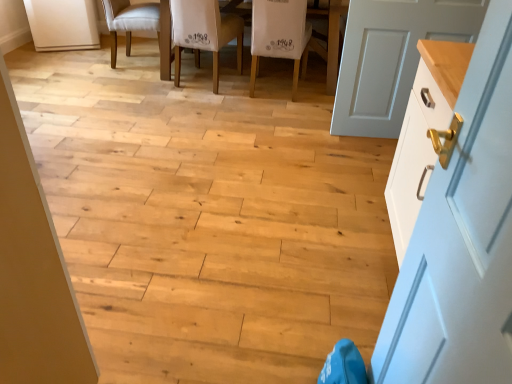
Describe the element at coordinates (130, 21) in the screenshot. The width and height of the screenshot is (512, 384). I see `white fabric chair at upper center, which appears as the third chair when viewed from the right` at that location.

The width and height of the screenshot is (512, 384). I want to click on white fabric chair at upper center, which appears as the first chair when viewed from the left, so click(130, 21).

Describe the element at coordinates (331, 35) in the screenshot. The image size is (512, 384). I see `wooden table at center` at that location.

Find the location of `white fabric chair at center, the third chair viewed from the left`. white fabric chair at center, the third chair viewed from the left is located at coordinates (280, 35).

Describe the element at coordinates (391, 58) in the screenshot. I see `white painted wood door at right, positioned as the 1th door in right-to-left order` at that location.

Identify the location of white fabric chair at upper center, which appears as the third chair when viewed from the right. The width and height of the screenshot is (512, 384). (130, 21).

From the image's perspective, would you say white painted wood door at right, positioned as the 1th door in right-to-left order, is positioned over wooden table at center?

Actually, white painted wood door at right, positioned as the 1th door in right-to-left order, appears below wooden table at center in the image.

How distant is white painted wood door at right, positioned as the 1th door in right-to-left order, from wooden table at center?

25.01 inches.

Is white painted wood door at right, the 1th door positioned from the back, facing towards wooden table at center?

No, white painted wood door at right, the 1th door positioned from the back, is not facing towards wooden table at center.

Considering the positions of objects white painted wood door at right, the second door when ordered from left to right, and wooden table at center in the image provided, who is more to the right, white painted wood door at right, the second door when ordered from left to right, or wooden table at center?

white painted wood door at right, the second door when ordered from left to right, is more to the right.

From the picture: Who is shorter, white painted wood door at right, which appears as the second door when viewed from the front, or wooden floor at center?

With less height is wooden floor at center.

Which point is more forward, (348, 134) or (318, 60)?

Positioned in front is point (348, 134).

From the image's perspective, does wooden floor at center appear lower than white glossy door at right, which appears as the 2th door when viewed from the right?

No, from the image's perspective, wooden floor at center is not below white glossy door at right, which appears as the 2th door when viewed from the right.

Is wooden floor at center shorter than white glossy door at right, which appears as the 2th door when viewed from the right?

Indeed, wooden floor at center has a lesser height compared to white glossy door at right, which appears as the 2th door when viewed from the right.

From the picture: Which point is more distant from viewer, (61, 119) or (500, 123)?

The point (61, 119) is behind.

Based on the photo, is wooden floor at center looking in the opposite direction of white glossy door at right, the 2th door positioned from the back?

No, wooden floor at center is not facing the opposite direction of white glossy door at right, the 2th door positioned from the back.

Between white fabric chair at center, the 2th chair when ordered from left to right, and white fabric chair at upper center, which appears as the third chair when viewed from the right, which one appears on the right side from the viewer's perspective?

white fabric chair at center, the 2th chair when ordered from left to right.

Can white fabric chair at upper center, which appears as the first chair when viewed from the left, be found inside white fabric chair at center, the 2th chair when ordered from left to right?

Actually, white fabric chair at upper center, which appears as the first chair when viewed from the left, is outside white fabric chair at center, the 2th chair when ordered from left to right.

At what (x,y) coordinates should I click in order to perform the action: click on chair that appears on the left of white fabric chair at center, the 2th chair when ordered from left to right. Please return your answer as a coordinate pair (x, y). Looking at the image, I should click on (130, 21).

Which is farther, (191,24) or (129,18)?

The point (129,18) is farther from the camera.

Is wooden table at center taller than white fabric chair at center, which is the 2th chair from right to left?

Yes, wooden table at center is taller than white fabric chair at center, which is the 2th chair from right to left.

From the image's perspective, is wooden table at center under white fabric chair at center, which is the 2th chair from right to left?

Incorrect, from the image's perspective, wooden table at center is higher than white fabric chair at center, which is the 2th chair from right to left.

Considering the sizes of objects wooden table at center and white fabric chair at center, which is the 2th chair from right to left, in the image provided, who is wider, wooden table at center or white fabric chair at center, which is the 2th chair from right to left,?

wooden table at center is wider.

Is white fabric chair at center, marked as the first chair in a right-to-left arrangement, smaller than white glossy door at right, placed as the 1th door when sorted from left to right?

Incorrect, white fabric chair at center, marked as the first chair in a right-to-left arrangement, is not smaller in size than white glossy door at right, placed as the 1th door when sorted from left to right.

Looking at this image, from the image's perspective, which object appears higher, white fabric chair at center, the third chair viewed from the left, or white glossy door at right, the second door positioned from the top?

white fabric chair at center, the third chair viewed from the left.

Is white fabric chair at center, the third chair viewed from the left, facing away from white glossy door at right, positioned as the first door in bottom-to-top order?

That's right, white fabric chair at center, the third chair viewed from the left, is facing away from white glossy door at right, positioned as the first door in bottom-to-top order.

Is white fabric chair at center, the third chair viewed from the left, inside the boundaries of white glossy door at right, the 2th door positioned from the back, or outside?

white fabric chair at center, the third chair viewed from the left, is located beyond the bounds of white glossy door at right, the 2th door positioned from the back.

Which object is more forward, white fabric chair at center, the third chair viewed from the left, or white fabric chair at upper center, which appears as the first chair when viewed from the left?

Positioned in front is white fabric chair at center, the third chair viewed from the left.

Is white fabric chair at center, marked as the first chair in a right-to-left arrangement, inside or outside of white fabric chair at upper center, which appears as the first chair when viewed from the left?

white fabric chair at center, marked as the first chair in a right-to-left arrangement, lies outside white fabric chair at upper center, which appears as the first chair when viewed from the left.

From a real-world perspective, is white fabric chair at center, marked as the first chair in a right-to-left arrangement, below white fabric chair at upper center, which appears as the first chair when viewed from the left?

No, from a real-world perspective, white fabric chair at center, marked as the first chair in a right-to-left arrangement, is not beneath white fabric chair at upper center, which appears as the first chair when viewed from the left.

Between white fabric chair at center, the third chair viewed from the left, and white fabric chair at upper center, which appears as the first chair when viewed from the left, which one has more height?

With more height is white fabric chair at center, the third chair viewed from the left.

You are a GUI agent. You are given a task and a screenshot of the screen. Output one action in this format:
    pyautogui.click(x=<x>, y=<y>)
    Task: Click on the table directly beneath the white painted wood door at right, which is counted as the 1th door, starting from the top (from a real-world perspective)
    Image resolution: width=512 pixels, height=384 pixels.
    Given the screenshot: What is the action you would take?
    pyautogui.click(x=331, y=35)

This screenshot has height=384, width=512. Identify the location of door lying above the wooden floor at center (from the image's perspective). (391, 58).

When comparing their distances from white painted wood door at right, which appears as the second door when viewed from the front, does white fabric chair at upper center, which appears as the third chair when viewed from the right, or wooden floor at center seem closer?

wooden floor at center is positioned closer to the anchor white painted wood door at right, which appears as the second door when viewed from the front.

Looking at the image, which one is located further to wooden table at center, white glossy door at right, which appears as the 2th door when viewed from the right, or white fabric chair at center, marked as the first chair in a right-to-left arrangement?

white glossy door at right, which appears as the 2th door when viewed from the right, is positioned further to the anchor wooden table at center.

Based on their spatial positions, is white glossy door at right, the 1th door positioned from the front, or white fabric chair at upper center, which appears as the first chair when viewed from the left, further from white fabric chair at center, the third chair viewed from the left?

Based on the image, white glossy door at right, the 1th door positioned from the front, appears to be further to white fabric chair at center, the third chair viewed from the left.

Based on their spatial positions, is wooden table at center or white glossy door at right, the 2th door positioned from the back, closer to wooden floor at center?

white glossy door at right, the 2th door positioned from the back, is positioned closer to the anchor wooden floor at center.

Based on their spatial positions, is wooden table at center or white fabric chair at center, marked as the first chair in a right-to-left arrangement, closer to wooden floor at center?

white fabric chair at center, marked as the first chair in a right-to-left arrangement, lies closer to wooden floor at center than the other object.

Estimate the real-world distances between objects in this image. Which object is further from wooden table at center, white fabric chair at upper center, which appears as the third chair when viewed from the right, or wooden floor at center?

Based on the image, white fabric chair at upper center, which appears as the third chair when viewed from the right, appears to be further to wooden table at center.

When comparing their distances from white glossy door at right, placed as the 1th door when sorted from left to right, does white painted wood door at right, which is counted as the 1th door, starting from the top, or white fabric chair at center, the 2th chair when ordered from left to right, seem closer?

The object closer to white glossy door at right, placed as the 1th door when sorted from left to right, is white painted wood door at right, which is counted as the 1th door, starting from the top.

Considering their positions, is white fabric chair at upper center, which appears as the first chair when viewed from the left, positioned further to white fabric chair at center, marked as the first chair in a right-to-left arrangement, than white painted wood door at right, which appears as the second door when viewed from the front?

Among the two, white fabric chair at upper center, which appears as the first chair when viewed from the left, is located further to white fabric chair at center, marked as the first chair in a right-to-left arrangement.

Identify the location of table between white fabric chair at upper center, which appears as the third chair when viewed from the right, and white painted wood door at right, the 1th door positioned from the back. The image size is (512, 384). (331, 35).

Identify the location of stair between white glossy door at right, the 1th door positioned from the front, and white fabric chair at upper center, which appears as the first chair when viewed from the left, from front to back. The width and height of the screenshot is (512, 384). (208, 214).

The image size is (512, 384). Identify the location of stair located between white fabric chair at upper center, which appears as the first chair when viewed from the left, and white painted wood door at right, which is counted as the 1th door, starting from the top, in the left-right direction. (208, 214).

Where is `table between white glossy door at right, the 1th door positioned from the front, and white fabric chair at upper center, which appears as the third chair when viewed from the right, in the front-back direction`? table between white glossy door at right, the 1th door positioned from the front, and white fabric chair at upper center, which appears as the third chair when viewed from the right, in the front-back direction is located at coordinates (331, 35).